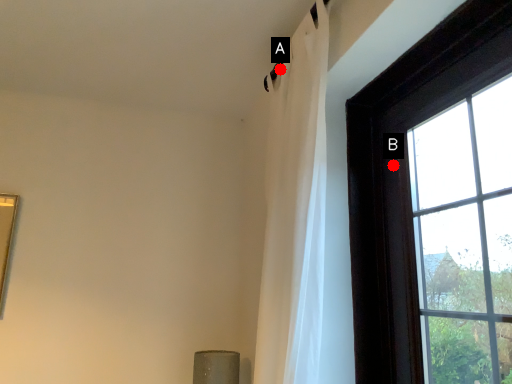
Question: Two points are circled on the image, labeled by A and B beside each circle. Which point appears closest to the camera in this image?

Choices:
 (A) A is closer
 (B) B is closer

Answer: (B)